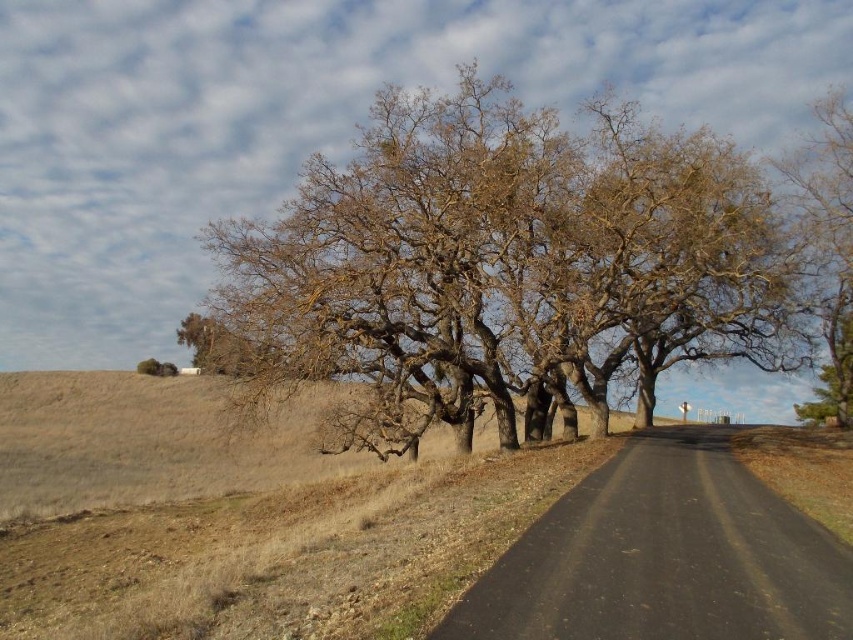
Does point (16, 492) lie behind point (811, 188)?

No, (16, 492) is in front of (811, 188).

Is brown grassy hill at lower left positioned in front of brown rough bark tree at right?

That is True.

Does point (12, 372) come in front of point (817, 244)?

No, it is not.

Find the location of a particular element. This screenshot has height=640, width=853. brown grassy hill at lower left is located at coordinates (152, 440).

Between brown rough bark tree at center and brown rough bark tree at right, which one has less height?

Standing shorter between the two is brown rough bark tree at center.

Is point (422, 420) positioned in front of point (825, 204)?

Yes, point (422, 420) is closer to viewer.

The height and width of the screenshot is (640, 853). In order to click on brown rough bark tree at center in this screenshot , I will do `click(509, 260)`.

Does brown rough bark tree at center appear under brown grassy hill at lower left?

Incorrect, brown rough bark tree at center is not positioned below brown grassy hill at lower left.

Which is in front, point (729, 244) or point (26, 460)?

Positioned in front is point (729, 244).

This screenshot has width=853, height=640. Find the location of `brown rough bark tree at center`. brown rough bark tree at center is located at coordinates (509, 260).